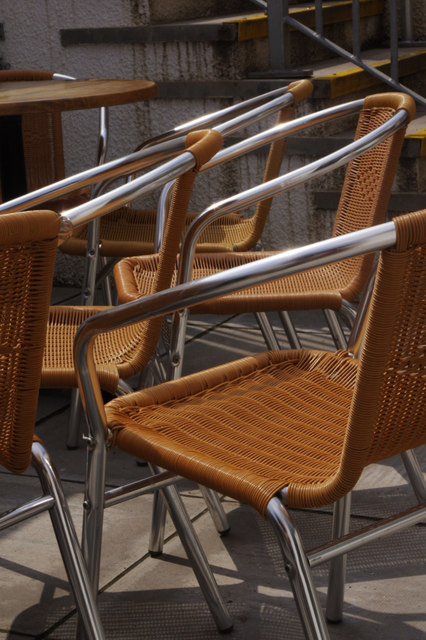
Find the location of a particular element. The image size is (426, 640). table is located at coordinates [62, 93].